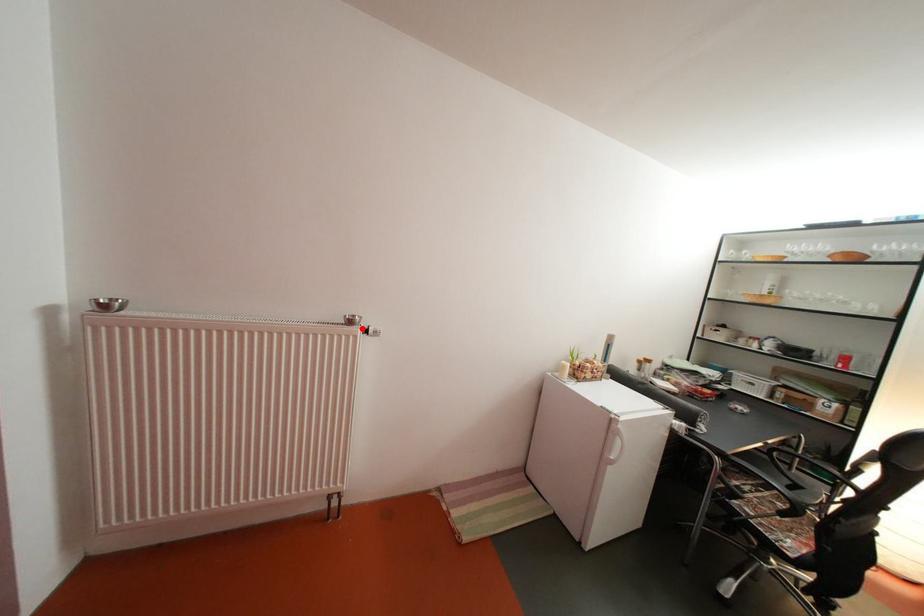
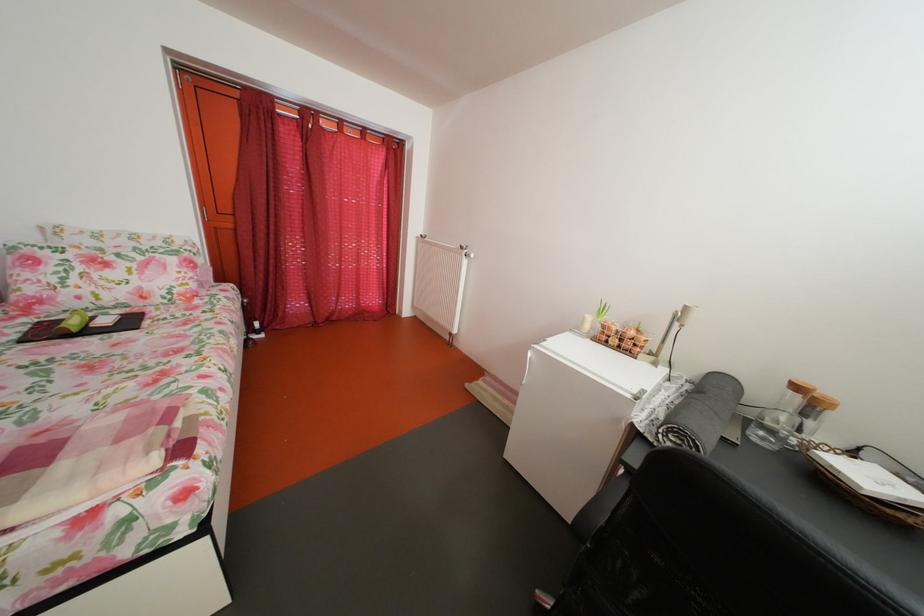
Find the pixel in the second image that matches the highlighted location in the first image.

(473, 254)